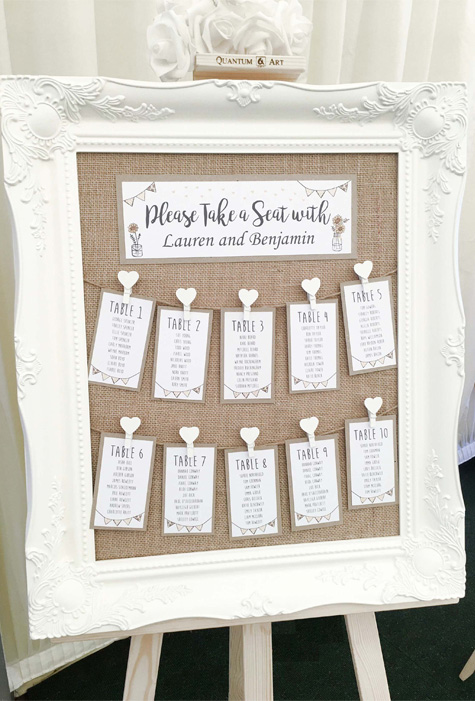
Image resolution: width=475 pixels, height=701 pixels. Find the location of `canvas`. canvas is located at coordinates (381, 205), (376, 523), (132, 547), (214, 421), (299, 409), (206, 278), (281, 279), (89, 191), (237, 163).